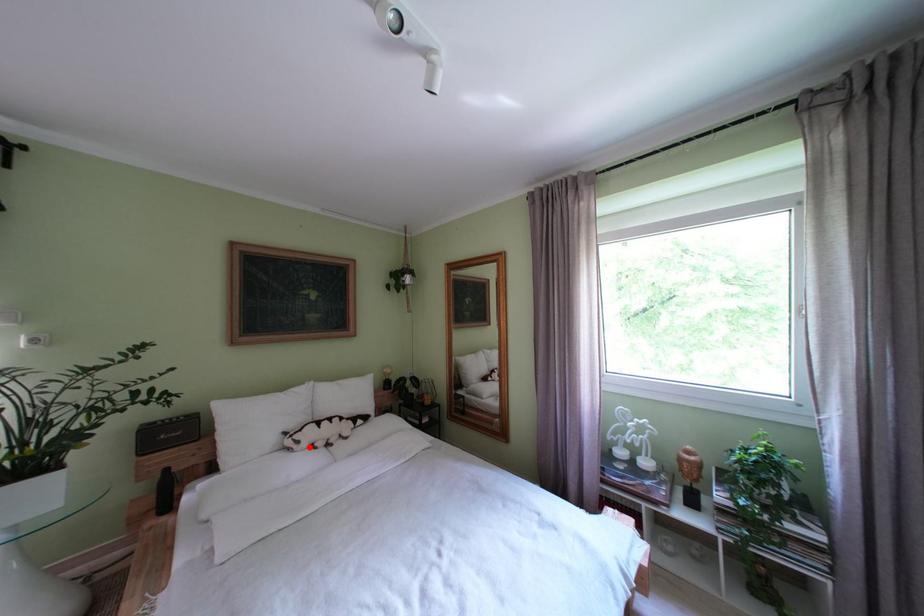
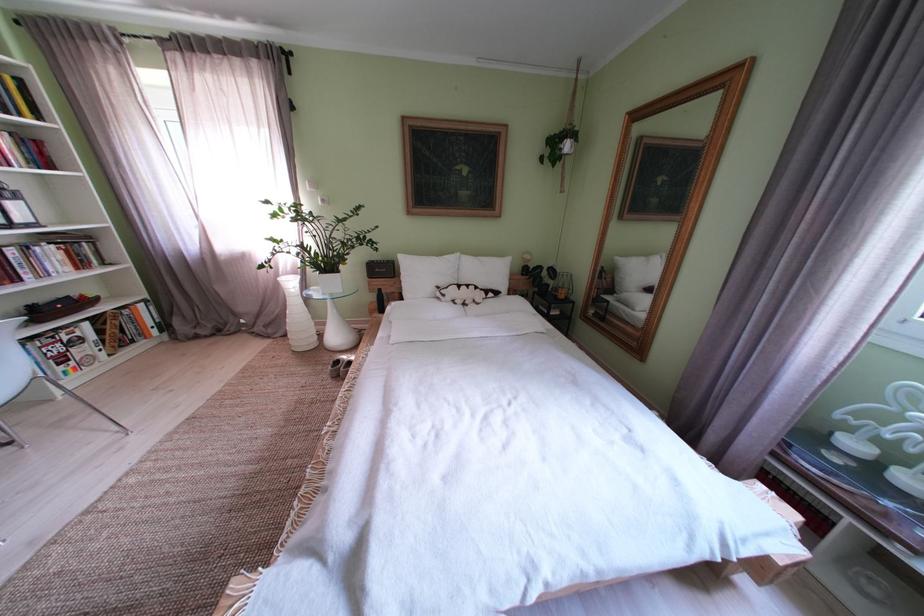
Question: I am providing you with two images of the same scene from different viewpoints. Given a red point in image1, look at the same physical point in image2. Is it:

Choices:
 (A) Closer to the viewpoint
 (B) Farther from the viewpoint

Answer: (A)